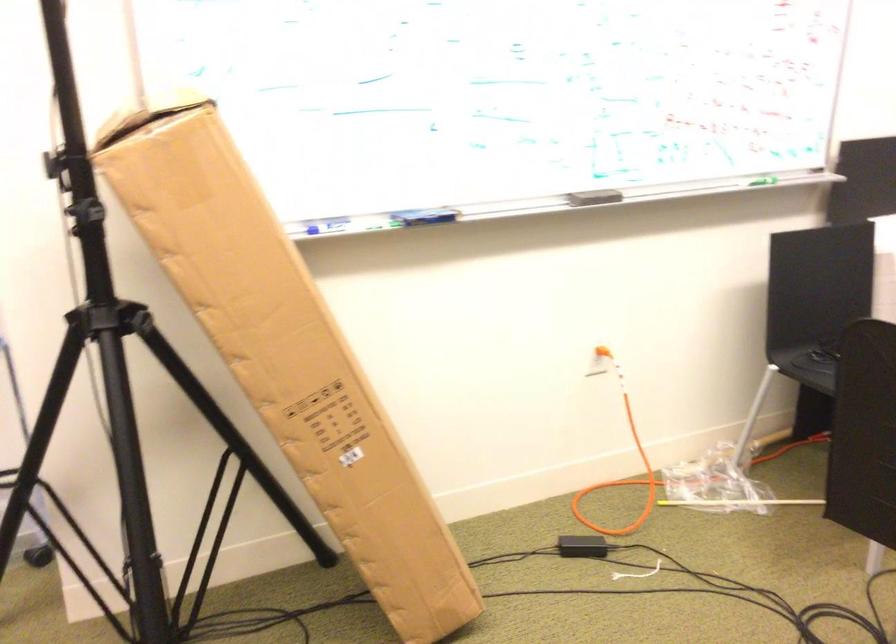
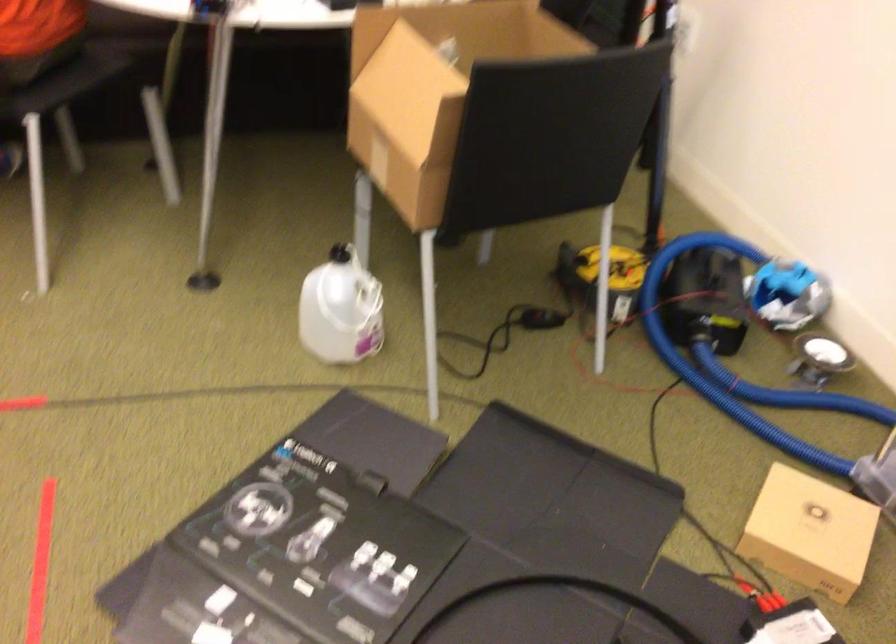
The first image is from the beginning of the video and the second image is from the end. How did the camera likely rotate when shooting the video?

The camera's rotation is toward left-down.